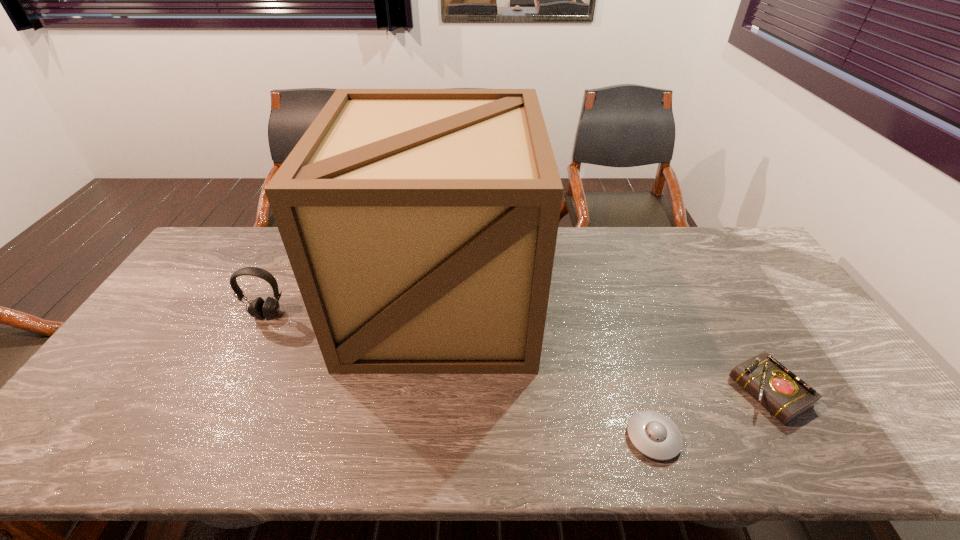
Where is `free space in the image that satisfies the following two spatial constraints: 1. on the front-facing side of the leftmost object; 2. on the left side of the diary`? free space in the image that satisfies the following two spatial constraints: 1. on the front-facing side of the leftmost object; 2. on the left side of the diary is located at coordinates (228, 392).

The width and height of the screenshot is (960, 540). What are the coordinates of `vacant space that satisfies the following two spatial constraints: 1. on the front-facing side of the third object from left to right; 2. on the left side of the leftmost object` in the screenshot? It's located at (205, 437).

Where is `free region that satisfies the following two spatial constraints: 1. on the reinforced sides of the second object from right to left; 2. on the left side of the tallest object`? Image resolution: width=960 pixels, height=540 pixels. free region that satisfies the following two spatial constraints: 1. on the reinforced sides of the second object from right to left; 2. on the left side of the tallest object is located at coordinates (427, 437).

At what (x,y) coordinates should I click in order to perform the action: click on free spot that satisfies the following two spatial constraints: 1. on the reinforced sides of the diary; 2. on the right side of the box. Please return your answer as a coordinate pair (x, y). Image resolution: width=960 pixels, height=540 pixels. Looking at the image, I should click on (432, 392).

Identify the location of free space that satisfies the following two spatial constraints: 1. on the reinforced sides of the tallest object; 2. on the right side of the diary. (432, 392).